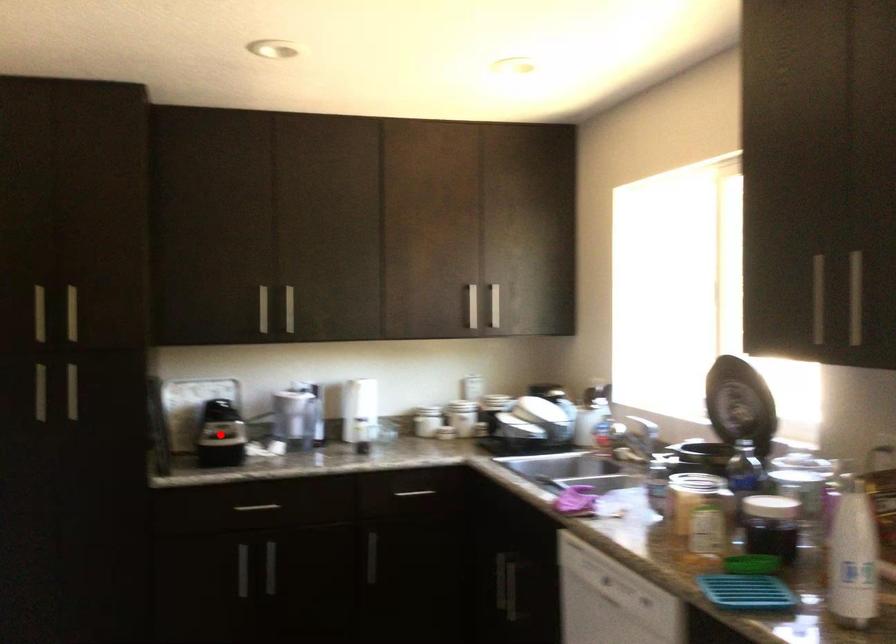
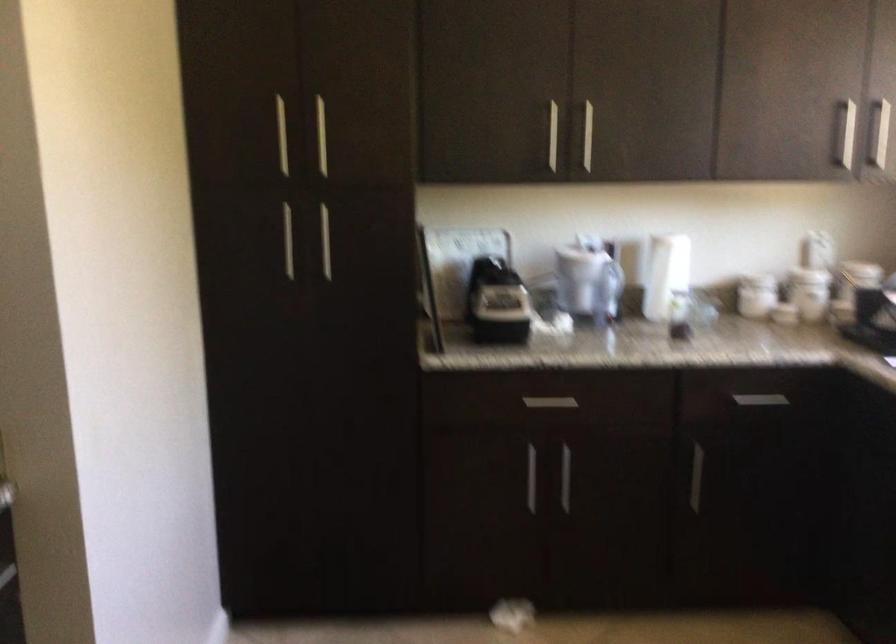
In the second image, find the point that corresponds to the highlighted location in the first image.

(496, 301)